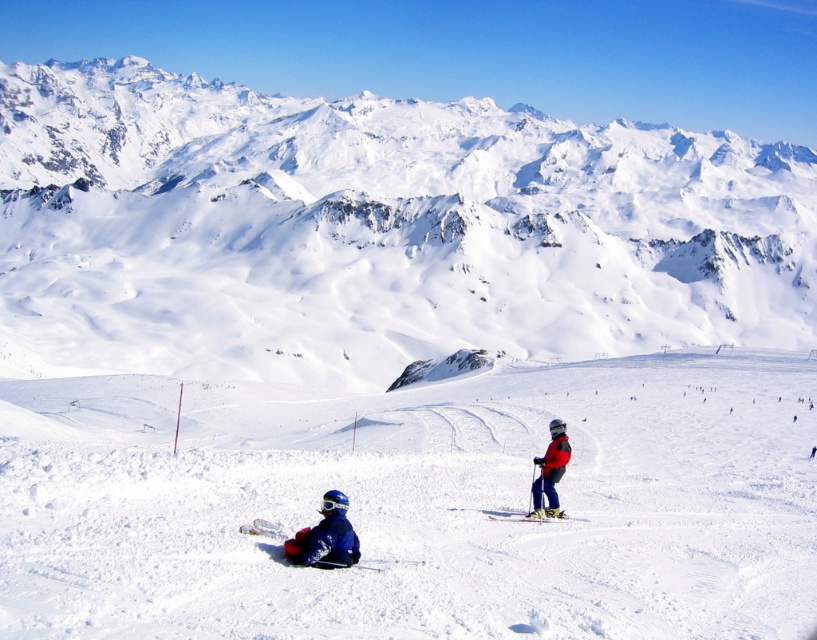
You are a photographer trying to capture the blue fleece jacket at lower center in the center of your camera frame. Given the jacket is located at point 0.839 on the horizontal axis and 0.400 on the vertical axis, will you need to adjust your camera to the left or right to center it?

The blue fleece jacket at lower center is located at point 0.839 on the horizontal axis. Since the center of the frame is at 0.5, the jacket is to the right of center. To center it, you would need to adjust the camera to the left.

You are a photographer trying to capture a closeup of the red ski suit at center. You are currently positioned at point (550, 470). Can you get a clear shot of the red ski suit at center from your current position?

Yes, because the point (550, 470) is on the red ski suit at center, so you are already positioned directly on it and can capture a clear closeup.